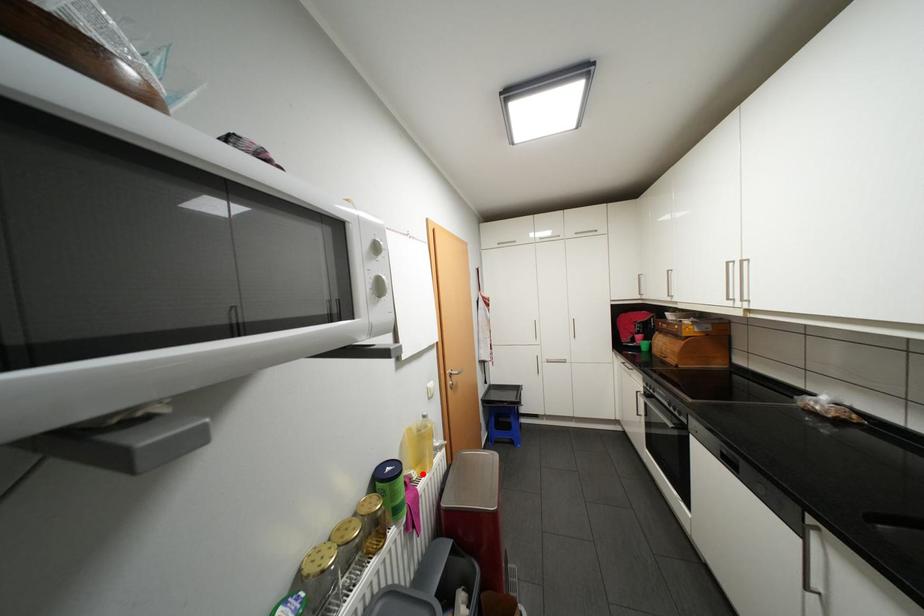
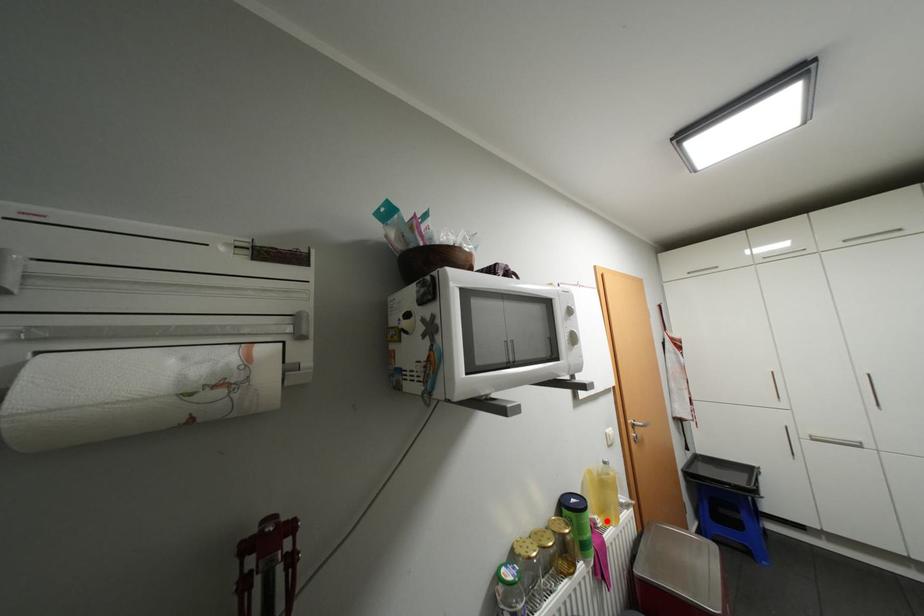
I am providing you with two images of the same scene from different viewpoints. A red point is marked on the first image and another point is marked on the second image. Is the marked point in image1 the same physical position as the marked point in image2?

Yes